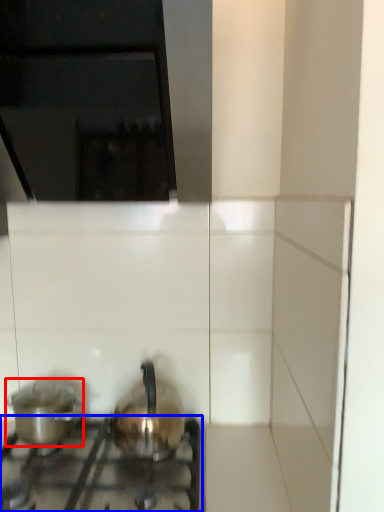
Question: Among these objects, which one is nearest to the camera, kitchen appliance (highlighted by a red box) or gas stove (highlighted by a blue box)?

Choices:
 (A) kitchen appliance
 (B) gas stove

Answer: (B)